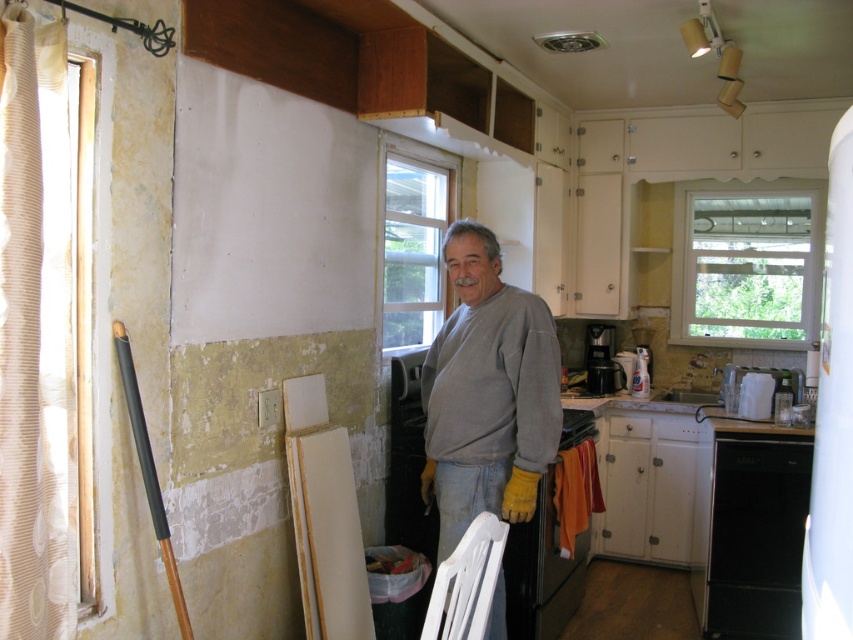
Looking at this image, is gray cotton shirt at center below black matte dishwasher at lower right?

No.

Does gray cotton shirt at center appear on the right side of black matte dishwasher at lower right?

No, gray cotton shirt at center is not to the right of black matte dishwasher at lower right.

This screenshot has height=640, width=853. Find the location of `gray cotton shirt at center`. gray cotton shirt at center is located at coordinates (486, 392).